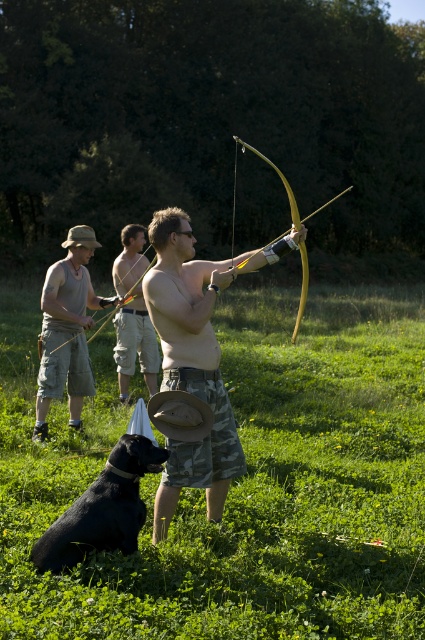
Who is shorter, camouflage shorts at center or wooden bow at center?

camouflage shorts at center

Is point (170, 230) in front of point (294, 323)?

Yes, it is.

Identify the location of camouflage shorts at center. This screenshot has height=640, width=425. (195, 358).

Is matte gray shirt at center bigger than wooden bow at center?

Actually, matte gray shirt at center might be smaller than wooden bow at center.

Can you confirm if matte gray shirt at center is taller than wooden bow at center?

Incorrect, matte gray shirt at center's height is not larger of wooden bow at center's.

Which is behind, point (81, 241) or point (297, 323)?

Point (297, 323)

I want to click on matte gray shirt at center, so tap(67, 330).

Who is taller, black fur dog at lower left or matte beige tank top at center?

With more height is matte beige tank top at center.

Between black fur dog at lower left and matte beige tank top at center, which one has less height?

With less height is black fur dog at lower left.

Who is more forward, (x=116, y=524) or (x=116, y=264)?

Point (x=116, y=524)

Locate an element on the screen. The height and width of the screenshot is (640, 425). black fur dog at lower left is located at coordinates (102, 508).